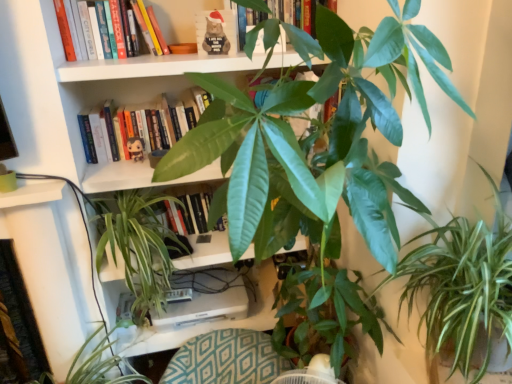
This screenshot has width=512, height=384. Find the location of `teal fabric swivel chair at center`. teal fabric swivel chair at center is located at coordinates (226, 359).

What is the approximate width of matte black plush toy at upper center?

0.83 inches.

The image size is (512, 384). Describe the element at coordinates (216, 32) in the screenshot. I see `matte black plush toy at upper center` at that location.

In order to face hardcover book at upper center, which ranks as the first book in top-to-bottom order, should I rotate leftwards or rightwards?

It's best to rotate right around 3.017 degrees.

The height and width of the screenshot is (384, 512). Find the location of `green leafy plant at lower left, the third houseplant in the right-to-left sequence`. green leafy plant at lower left, the third houseplant in the right-to-left sequence is located at coordinates (99, 364).

You are a GUI agent. You are given a task and a screenshot of the screen. Output one action in this format:
    pyautogui.click(x=<x>, y=<y>)
    Task: Click on the green glossy leafy plant at center, which is the third houseplant in left-to-right order
    The width and height of the screenshot is (512, 384).
    Given the screenshot: What is the action you would take?
    pyautogui.click(x=462, y=289)

Is green glossy leafy plant at center, which is the third houseplant in left-to-right order, located outside matte black plush toy at upper center?

Yes.

Which point is more distant from viewer, (501, 244) or (199, 20)?

Positioned behind is point (199, 20).

How far apart are green glossy leafy plant at center, the first houseplant positioned from the right, and matte black plush toy at upper center?

green glossy leafy plant at center, the first houseplant positioned from the right, is 3.46 feet away from matte black plush toy at upper center.

From a real-world perspective, is green glossy leafy plant at center, the first houseplant positioned from the right, positioned over matte black plush toy at upper center based on gravity?

No, from a real-world perspective, green glossy leafy plant at center, the first houseplant positioned from the right, is not over matte black plush toy at upper center

Is matte black plush toy at upper center wider than green leafy plant at lower right?

Incorrect, the width of matte black plush toy at upper center does not surpass that of green leafy plant at lower right.

Is point (218, 12) positioned in front of point (474, 352)?

No, it is not.

Is the depth of matte black plush toy at upper center greater than that of green leafy plant at lower right?

Yes.

Is matte black plush toy at upper center far from green leafy plant at lower right?

Indeed, matte black plush toy at upper center is not near green leafy plant at lower right.

Is green leafy plant at lower left, the third houseplant in the right-to-left sequence, not inside hardcover book at upper center, the third book when ordered from bottom to top?

Yes.

Which is in front, point (44, 374) or point (313, 17)?

The point (313, 17) is closer.

Is green leafy plant at lower left, the third houseplant in the right-to-left sequence, looking in the opposite direction of hardcover book at upper center, which ranks as the first book in top-to-bottom order?

green leafy plant at lower left, the third houseplant in the right-to-left sequence, is not turned away from hardcover book at upper center, which ranks as the first book in top-to-bottom order.

Considering the sizes of objects green leafy plant at lower left, the 1th houseplant from the left, and hardcover book at upper center, which ranks as the first book in top-to-bottom order, in the image provided, who is shorter, green leafy plant at lower left, the 1th houseplant from the left, or hardcover book at upper center, which ranks as the first book in top-to-bottom order,?

Standing shorter between the two is hardcover book at upper center, which ranks as the first book in top-to-bottom order.

Is green glossy plant at center, the 2th houseplant in the right-to-left sequence, directly adjacent to green leafy plant at lower right?

No, green glossy plant at center, the 2th houseplant in the right-to-left sequence, is not making contact with green leafy plant at lower right.

Choose the correct answer: Is green glossy plant at center, the 2th houseplant in the right-to-left sequence, inside green leafy plant at lower right or outside it?

green glossy plant at center, the 2th houseplant in the right-to-left sequence, is not inside green leafy plant at lower right, it's outside.

Could you measure the distance between green glossy plant at center, the 2th houseplant in the right-to-left sequence, and green leafy plant at lower right?

green glossy plant at center, the 2th houseplant in the right-to-left sequence, is 3.75 feet away from green leafy plant at lower right.

Is green glossy plant at center, which ranks as the second houseplant in left-to-right order, further to camera compared to green leafy plant at lower right?

That is True.

Which is farther from the camera, (508, 360) or (312, 8)?

The point (508, 360) is behind.

Would you say green leafy plant at lower right is a long distance from hardcover book at upper center, which ranks as the first book in top-to-bottom order?

No, green leafy plant at lower right is not far away from hardcover book at upper center, which ranks as the first book in top-to-bottom order.

Locate an element on the screen. flowerpot in front of the hardcover book at upper center, the third book when ordered from bottom to top is located at coordinates tap(499, 351).

Is hardcover book at upper left, the 2th book from the bottom, situated inside green matte book at upper center, which appears as the 3th book when viewed from the top, or outside?

hardcover book at upper left, the 2th book from the bottom, is not inside green matte book at upper center, which appears as the 3th book when viewed from the top, it's outside.

Is hardcover book at upper left, the 2th book from the bottom, taller than green matte book at upper center, the first book positioned from the bottom?

No.

Is point (116, 6) closer or farther from the camera than point (126, 142)?

Clearly, point (116, 6) is closer to the camera than point (126, 142).

Considering the sizes of objects hardcover book at upper left, the second book when ordered from top to bottom, and hardcover book at upper center, the third book when ordered from bottom to top, in the image provided, who is shorter, hardcover book at upper left, the second book when ordered from top to bottom, or hardcover book at upper center, the third book when ordered from bottom to top,?

With less height is hardcover book at upper center, the third book when ordered from bottom to top.

Is hardcover book at upper left, the 2th book from the bottom, positioned with its back to hardcover book at upper center, which ranks as the first book in top-to-bottom order?

No.

Is hardcover book at upper center, the third book when ordered from bottom to top, completely or partially inside hardcover book at upper left, the second book when ordered from top to bottom?

Actually, hardcover book at upper center, the third book when ordered from bottom to top, is outside hardcover book at upper left, the second book when ordered from top to bottom.

Are hardcover book at upper left, the 2th book from the bottom, and hardcover book at upper center, which ranks as the first book in top-to-bottom order, beside each other?

No, hardcover book at upper left, the 2th book from the bottom, is not with hardcover book at upper center, which ranks as the first book in top-to-bottom order.

The image size is (512, 384). Find the location of `paperback book behind the green glossy leafy plant at center, the first houseplant positioned from the right`. paperback book behind the green glossy leafy plant at center, the first houseplant positioned from the right is located at coordinates (216, 32).

Find the location of `flowerpot lying below the matte black plush toy at upper center (from the image's perspective)`. flowerpot lying below the matte black plush toy at upper center (from the image's perspective) is located at coordinates (499, 351).

Considering their positions, is teal fabric swivel chair at center positioned closer to green matte book at upper center, the first book positioned from the bottom, than green leafy plant at lower left, the third houseplant in the right-to-left sequence?

green leafy plant at lower left, the third houseplant in the right-to-left sequence, lies closer to green matte book at upper center, the first book positioned from the bottom, than the other object.

From the image, which object appears to be nearer to green matte book at upper center, the first book positioned from the bottom, green leafy plant at lower left, the third houseplant in the right-to-left sequence, or green leafy plant at lower right?

green leafy plant at lower left, the third houseplant in the right-to-left sequence, lies closer to green matte book at upper center, the first book positioned from the bottom, than the other object.

In the scene shown: Looking at the image, which one is located closer to hardcover book at upper left, the 2th book from the bottom, teal fabric swivel chair at center or hardcover book at upper center, which ranks as the first book in top-to-bottom order?

hardcover book at upper center, which ranks as the first book in top-to-bottom order, lies closer to hardcover book at upper left, the 2th book from the bottom, than the other object.

Estimate the real-world distances between objects in this image. Which object is closer to green glossy leafy plant at center, the first houseplant positioned from the right, green matte book at upper center, the first book positioned from the bottom, or teal fabric swivel chair at center?

The object closer to green glossy leafy plant at center, the first houseplant positioned from the right, is teal fabric swivel chair at center.

When comparing their distances from green leafy plant at lower left, the third houseplant in the right-to-left sequence, does hardcover book at upper left, the second book when ordered from top to bottom, or teal fabric swivel chair at center seem further?

The object further to green leafy plant at lower left, the third houseplant in the right-to-left sequence, is hardcover book at upper left, the second book when ordered from top to bottom.

From the image, which object appears to be nearer to green glossy leafy plant at center, the first houseplant positioned from the right, hardcover book at upper left, the 2th book from the bottom, or teal fabric swivel chair at center?

Among the two, teal fabric swivel chair at center is located nearer to green glossy leafy plant at center, the first houseplant positioned from the right.

Estimate the real-world distances between objects in this image. Which object is closer to green leafy plant at lower right, green glossy leafy plant at center, the first houseplant positioned from the right, or green matte book at upper center, the first book positioned from the bottom?

Based on the image, green glossy leafy plant at center, the first houseplant positioned from the right, appears to be nearer to green leafy plant at lower right.

Based on their spatial positions, is green glossy plant at center, which ranks as the second houseplant in left-to-right order, or matte black plush toy at upper center further from hardcover book at upper center, the third book when ordered from bottom to top?

green glossy plant at center, which ranks as the second houseplant in left-to-right order, is positioned further to the anchor hardcover book at upper center, the third book when ordered from bottom to top.

Locate an element on the screen. This screenshot has height=384, width=512. book located between green matte book at upper center, the first book positioned from the bottom, and green glossy leafy plant at center, the first houseplant positioned from the right, in the left-right direction is located at coordinates (281, 12).

At what (x,y) coordinates should I click in order to perform the action: click on paperback book between hardcover book at upper left, the second book when ordered from top to bottom, and green leafy plant at lower right, in the vertical direction. Please return your answer as a coordinate pair (x, y). The width and height of the screenshot is (512, 384). Looking at the image, I should click on (216, 32).

The width and height of the screenshot is (512, 384). What are the coordinates of `book between hardcover book at upper left, the second book when ordered from top to bottom, and green glossy plant at center, the 2th houseplant in the right-to-left sequence, vertically` in the screenshot? It's located at (153, 124).

Locate an element on the screen. The width and height of the screenshot is (512, 384). paperback book that lies between hardcover book at upper left, the 2th book from the bottom, and green glossy plant at center, the 2th houseplant in the right-to-left sequence, from top to bottom is located at coordinates (216, 32).